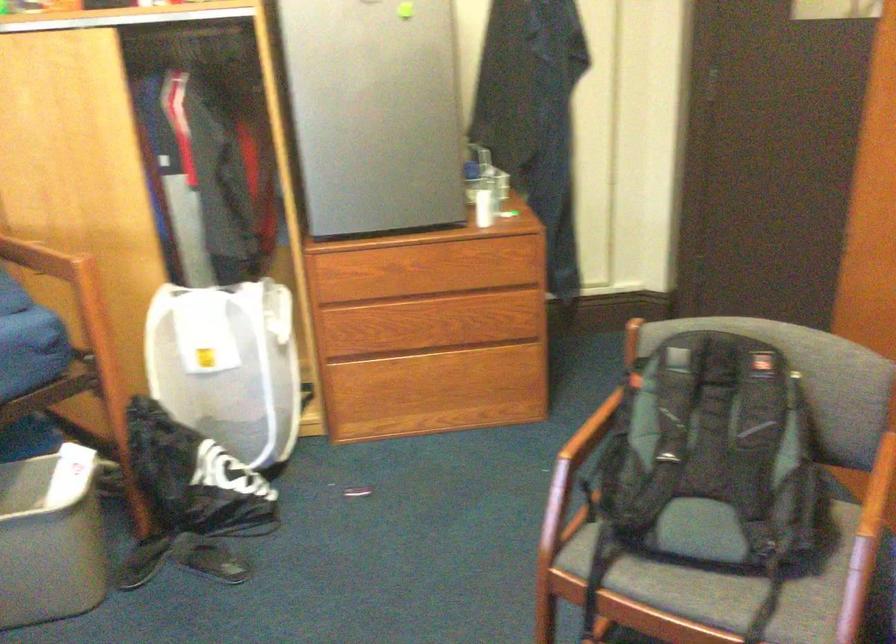
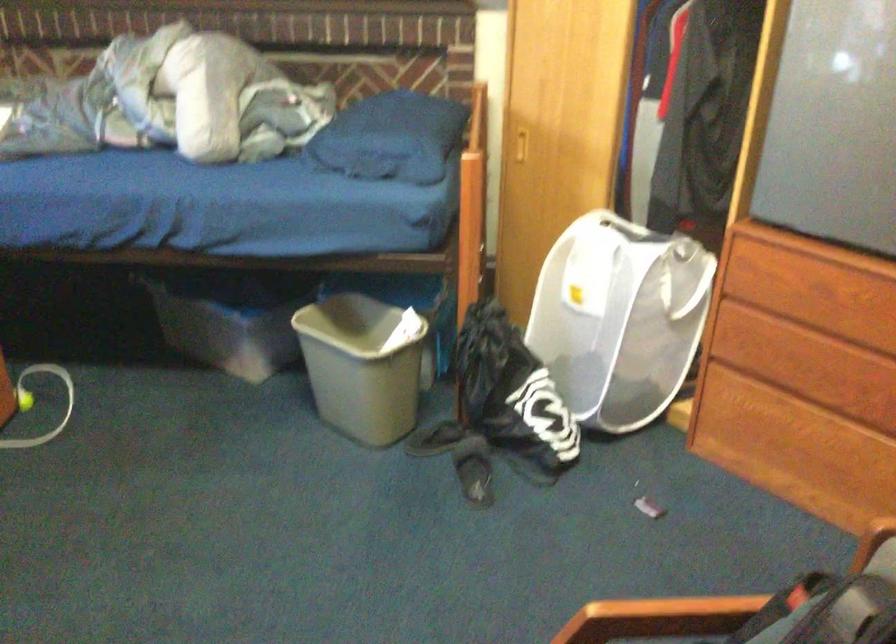
From the picture: The first image is from the beginning of the video and the second image is from the end. How did the camera likely rotate when shooting the video?

The camera's rotation is toward left-down.